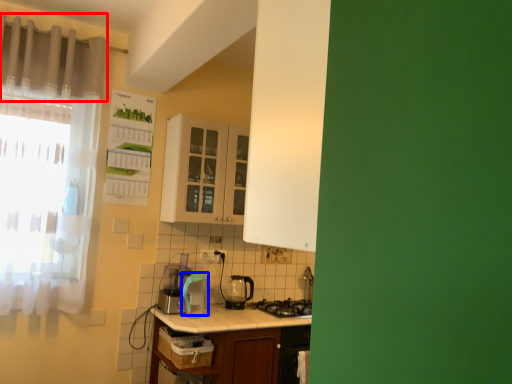
Question: Which point is closer to the camera, curtain (highlighted by a red box) or appliance (highlighted by a blue box)?

Choices:
 (A) curtain
 (B) appliance

Answer: (A)